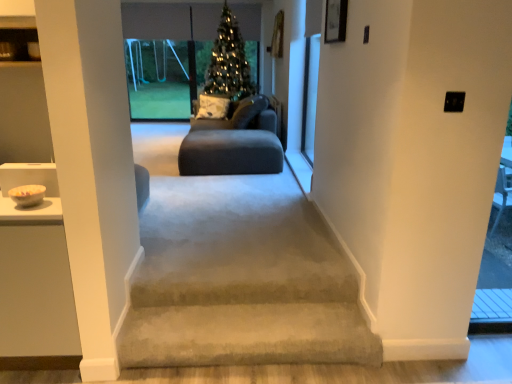
This screenshot has height=384, width=512. I want to click on transparent glass screen door at upper right, so click(310, 96).

This screenshot has height=384, width=512. What do you see at coordinates (234, 143) in the screenshot?
I see `suede-like dark gray sofa at center` at bounding box center [234, 143].

The width and height of the screenshot is (512, 384). What are the coordinates of `transparent glass swing set at upper center` in the screenshot? It's located at (158, 79).

What is the approximate width of white textured pillow at center?

The width of white textured pillow at center is 14.31 inches.

This screenshot has height=384, width=512. I want to click on transparent glass screen door at upper right, so click(310, 96).

Are green matte christmas tree at center and white textured pillow at center located far from each other?

No, green matte christmas tree at center is in close proximity to white textured pillow at center.

Is green matte christmas tree at center oriented away from white textured pillow at center?

No.

Who is bigger, green matte christmas tree at center or white textured pillow at center?

green matte christmas tree at center is bigger.

Is point (240, 90) closer or farther from the camera than point (198, 111)?

Clearly, point (240, 90) is closer to the camera than point (198, 111).

Who is bigger, suede-like dark gray sofa at center or white textured pillow at center?

suede-like dark gray sofa at center.

Which object is positioned more to the left, suede-like dark gray sofa at center or white textured pillow at center?

Positioned to the left is white textured pillow at center.

The width and height of the screenshot is (512, 384). I want to click on pillow behind the suede-like dark gray sofa at center, so click(x=212, y=107).

This screenshot has height=384, width=512. I want to click on christmas tree that is behind the suede-like dark gray sofa at center, so click(x=229, y=61).

Does suede-like dark gray sofa at center have a greater height compared to green matte christmas tree at center?

No, suede-like dark gray sofa at center is not taller than green matte christmas tree at center.

Which is in front, point (269, 114) or point (223, 53)?

Positioned in front is point (223, 53).

Is suede-like dark gray sofa at center positioned behind green matte christmas tree at center?

No, suede-like dark gray sofa at center is closer to the viewer.

Considering the positions of objects white textured pillow at center and transparent glass swing set at upper center in the image provided, who is behind, white textured pillow at center or transparent glass swing set at upper center?

transparent glass swing set at upper center is further away from the camera.

Can you tell me how much white textured pillow at center and transparent glass swing set at upper center differ in facing direction?

They differ by 2.25 degrees in their facing directions.

Is white textured pillow at center oriented towards transparent glass swing set at upper center?

No, white textured pillow at center is not oriented towards transparent glass swing set at upper center.

Which is correct: white textured pillow at center is inside transparent glass swing set at upper center, or outside of it?

white textured pillow at center exists outside the volume of transparent glass swing set at upper center.

Considering the relative sizes of white textured pillow at center and suede-like dark gray sofa at center in the image provided, is white textured pillow at center taller than suede-like dark gray sofa at center?

Indeed, white textured pillow at center has a greater height compared to suede-like dark gray sofa at center.

From the picture: Which of these two, white textured pillow at center or suede-like dark gray sofa at center, is thinner?

white textured pillow at center.

Choose the correct answer: Is white textured pillow at center inside suede-like dark gray sofa at center or outside it?

white textured pillow at center lies outside suede-like dark gray sofa at center.

Who is taller, transparent glass swing set at upper center or white textured pillow at center?

Standing taller between the two is transparent glass swing set at upper center.

From a real-world perspective, which object stands above the other?

In real-world perspective, transparent glass swing set at upper center is above.

Is transparent glass swing set at upper center not close to white textured pillow at center?

Actually, transparent glass swing set at upper center and white textured pillow at center are a little close together.

Which is in front, point (151, 106) or point (210, 106)?

The point (210, 106) is closer to the camera.

Which is correct: white textured pillow at center is inside green matte christmas tree at center, or outside of it?

white textured pillow at center is outside green matte christmas tree at center.

Considering the relative sizes of white textured pillow at center and green matte christmas tree at center in the image provided, is white textured pillow at center taller than green matte christmas tree at center?

Incorrect, the height of white textured pillow at center is not larger of that of green matte christmas tree at center.

This screenshot has width=512, height=384. What are the coordinates of `pillow below the green matte christmas tree at center (from the image's perspective)` in the screenshot? It's located at (212, 107).

Is green matte christmas tree at center at the back of white textured pillow at center?

Yes, white textured pillow at center's orientation is away from green matte christmas tree at center.

Identify the location of pillow located below the green matte christmas tree at center (from the image's perspective). The width and height of the screenshot is (512, 384). (212, 107).

Image resolution: width=512 pixels, height=384 pixels. Find the location of `studio couch on the right of white textured pillow at center`. studio couch on the right of white textured pillow at center is located at coordinates click(x=234, y=143).

Estimate the real-world distances between objects in this image. Which object is closer to transparent glass swing set at upper center, green matte christmas tree at center or white textured pillow at center?

green matte christmas tree at center is positioned closer to the anchor transparent glass swing set at upper center.

When comparing their distances from transparent glass screen door at upper right, does green matte christmas tree at center or suede-like dark gray sofa at center seem further?

The object further to transparent glass screen door at upper right is green matte christmas tree at center.

Based on their spatial positions, is transparent glass swing set at upper center or transparent glass screen door at upper right closer to white textured pillow at center?

transparent glass swing set at upper center is closer to white textured pillow at center.

Which object lies further to the anchor point white textured pillow at center, transparent glass screen door at upper right or green matte christmas tree at center?

Among the two, transparent glass screen door at upper right is located further to white textured pillow at center.

From the image, which object appears to be nearer to transparent glass screen door at upper right, suede-like dark gray sofa at center or transparent glass swing set at upper center?

The object closer to transparent glass screen door at upper right is suede-like dark gray sofa at center.

From the image, which object appears to be farther from transparent glass screen door at upper right, transparent glass swing set at upper center or suede-like dark gray sofa at center?

Among the two, transparent glass swing set at upper center is located further to transparent glass screen door at upper right.

When comparing their distances from suede-like dark gray sofa at center, does green matte christmas tree at center or white textured pillow at center seem closer?

white textured pillow at center is positioned closer to the anchor suede-like dark gray sofa at center.

When comparing their distances from suede-like dark gray sofa at center, does transparent glass screen door at upper right or green matte christmas tree at center seem closer?

transparent glass screen door at upper right.

Identify the location of pillow positioned between suede-like dark gray sofa at center and green matte christmas tree at center from near to far. (212, 107).

Locate an element on the screen. christmas tree between transparent glass screen door at upper right and transparent glass swing set at upper center in the front-back direction is located at coordinates (229, 61).

Locate an element on the screen. The width and height of the screenshot is (512, 384). christmas tree between white textured pillow at center and transparent glass swing set at upper center along the z-axis is located at coordinates (229, 61).

Locate an element on the screen. This screenshot has height=384, width=512. pillow located between suede-like dark gray sofa at center and transparent glass swing set at upper center in the depth direction is located at coordinates (212, 107).